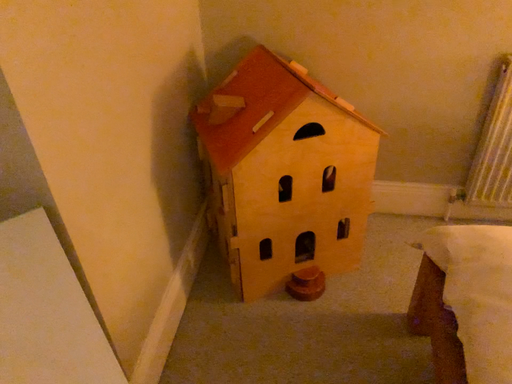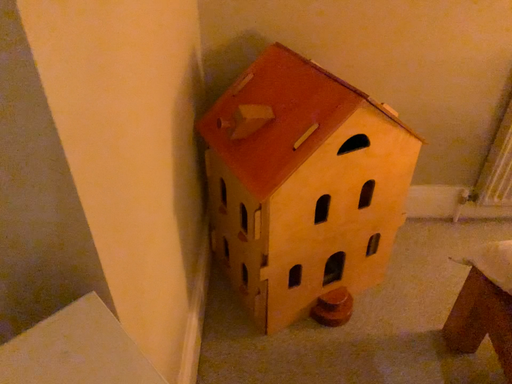
Question: How did the camera likely rotate when shooting the video?

Choices:
 (A) rotated right
 (B) rotated left

Answer: (A)